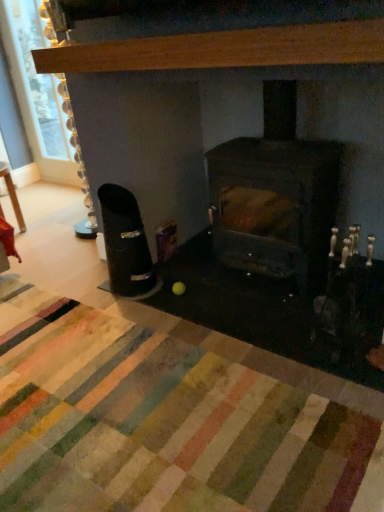
Find the location of a particular element. The height and width of the screenshot is (512, 384). dark brown wood burning stove at center is located at coordinates (275, 196).

This screenshot has height=512, width=384. Describe the element at coordinates (164, 421) in the screenshot. I see `multicolored rug at center` at that location.

Where is `multicolored rug at center`? The width and height of the screenshot is (384, 512). multicolored rug at center is located at coordinates (164, 421).

Locate an element on the screen. Image resolution: width=384 pixels, height=512 pixels. light brown wood mantel at upper center is located at coordinates (224, 49).

What are the coordinates of `dark brown wood burning stove at center` in the screenshot? It's located at (275, 196).

From the image's perspective, which is below, dark brown wood burning stove at center or multicolored rug at center?

multicolored rug at center is shown below in the image.

Is dark brown wood burning stove at center at the right side of multicolored rug at center?

Indeed, dark brown wood burning stove at center is positioned on the right side of multicolored rug at center.

Does dark brown wood burning stove at center have a greater height compared to multicolored rug at center?

Yes, dark brown wood burning stove at center is taller than multicolored rug at center.

Which is farther from the camera, (257, 259) or (275, 481)?

The point (257, 259) is farther from the camera.

Which is behind, point (30, 92) or point (117, 212)?

The point (30, 92) is behind.

From a real-world perspective, is clear glass window screen at upper left over black plastic ashtray at left?

Indeed, from a real-world perspective, clear glass window screen at upper left stands above black plastic ashtray at left.

Considering the sizes of objects clear glass window screen at upper left and black plastic ashtray at left in the image provided, who is bigger, clear glass window screen at upper left or black plastic ashtray at left?

Bigger between the two is clear glass window screen at upper left.

From the image's perspective, which one is positioned lower, clear glass window screen at upper left or black plastic ashtray at left?

black plastic ashtray at left appears lower in the image.

Who is taller, black plastic ashtray at left or multicolored rug at center?

With more height is black plastic ashtray at left.

Between black plastic ashtray at left and multicolored rug at center, which one has larger size?

With larger size is multicolored rug at center.

Is point (111, 267) less distant than point (57, 326)?

No, (111, 267) is further to viewer.

Which is more to the left, black plastic ashtray at left or multicolored rug at center?

multicolored rug at center.

How different are the orientations of black plastic ashtray at left and light brown wood mantel at upper center in degrees?

black plastic ashtray at left and light brown wood mantel at upper center are facing 1.55 degrees away from each other.

The height and width of the screenshot is (512, 384). What are the coordinates of `hardwood on the right of black plastic ashtray at left` in the screenshot? It's located at (224, 49).

From a real-world perspective, does black plastic ashtray at left sit lower than light brown wood mantel at upper center?

Yes, from a real-world perspective, black plastic ashtray at left is under light brown wood mantel at upper center.

Is point (142, 267) closer or farther from the camera than point (115, 56)?

Point (142, 267).

Is wooden table at left looking in the opposite direction of clear glass window screen at upper left?

No, wooden table at left is not facing away from clear glass window screen at upper left.

Looking at this image, can you confirm if wooden table at left is wider than clear glass window screen at upper left?

Correct, the width of wooden table at left exceeds that of clear glass window screen at upper left.

Is wooden table at left spatially inside clear glass window screen at upper left, or outside of it?

wooden table at left is located beyond the bounds of clear glass window screen at upper left.

Is wooden table at left at the back of clear glass window screen at upper left?

No, clear glass window screen at upper left is not facing away from wooden table at left.

From a real-world perspective, relative to wooden table at left, is clear glass window screen at upper left vertically above or below?

From a real-world perspective, clear glass window screen at upper left is physically above wooden table at left.

Which point is more forward, (47, 111) or (0, 208)?

The point (0, 208) is closer to the camera.

Is there a large distance between clear glass window screen at upper left and wooden table at left?

clear glass window screen at upper left is actually quite close to wooden table at left.

Looking at this image, is dark brown wood burning stove at center at the back of wooden table at left?

wooden table at left does not have its back to dark brown wood burning stove at center.

Consider the image. Between wooden table at left and dark brown wood burning stove at center, which one is positioned behind?

wooden table at left is further from the camera.

Is wooden table at left far away from dark brown wood burning stove at center?

Yes, wooden table at left is far from dark brown wood burning stove at center.

You are a GUI agent. You are given a task and a screenshot of the screen. Output one action in this format:
    pyautogui.click(x=<x>, y=<y>)
    Task: Click on the mat that appears on the left of dark brown wood burning stove at center
    
    Given the screenshot: What is the action you would take?
    pyautogui.click(x=164, y=421)

At what (x,y) coordinates should I click in order to perform the action: click on armchair on the right of clear glass window screen at upper left. Please return your answer as a coordinate pair (x, y). The image size is (384, 512). Looking at the image, I should click on (125, 243).

Estimate the real-world distances between objects in this image. Which object is further from clear glass window screen at upper left, light brown wood mantel at upper center or wooden table at left?

light brown wood mantel at upper center lies further to clear glass window screen at upper left than the other object.

From the image, which object appears to be farther from black plastic ashtray at left, wooden table at left or multicolored rug at center?

wooden table at left.

Looking at the image, which one is located further to dark brown wood burning stove at center, black plastic ashtray at left or wooden table at left?

wooden table at left is positioned further to the anchor dark brown wood burning stove at center.

Looking at the image, which one is located closer to black plastic ashtray at left, dark brown wood burning stove at center or multicolored rug at center?

The object closer to black plastic ashtray at left is dark brown wood burning stove at center.

Based on their spatial positions, is dark brown wood burning stove at center or black plastic ashtray at left further from multicolored rug at center?

The object further to multicolored rug at center is dark brown wood burning stove at center.

Looking at the image, which one is located further to clear glass window screen at upper left, wooden table at left or black plastic ashtray at left?

Among the two, black plastic ashtray at left is located further to clear glass window screen at upper left.

Based on their spatial positions, is clear glass window screen at upper left or light brown wood mantel at upper center further from wooden table at left?

The object further to wooden table at left is light brown wood mantel at upper center.

Based on their spatial positions, is dark brown wood burning stove at center or wooden table at left closer to clear glass window screen at upper left?

Among the two, wooden table at left is located nearer to clear glass window screen at upper left.

The width and height of the screenshot is (384, 512). I want to click on armchair located between clear glass window screen at upper left and dark brown wood burning stove at center in the left-right direction, so click(x=125, y=243).

The height and width of the screenshot is (512, 384). Identify the location of table between clear glass window screen at upper left and black plastic ashtray at left in the vertical direction. (12, 195).

Identify the location of armchair between multicolored rug at center and clear glass window screen at upper left in the front-back direction. (125, 243).

Identify the location of wood burning stove located between multicolored rug at center and clear glass window screen at upper left in the depth direction. (275, 196).